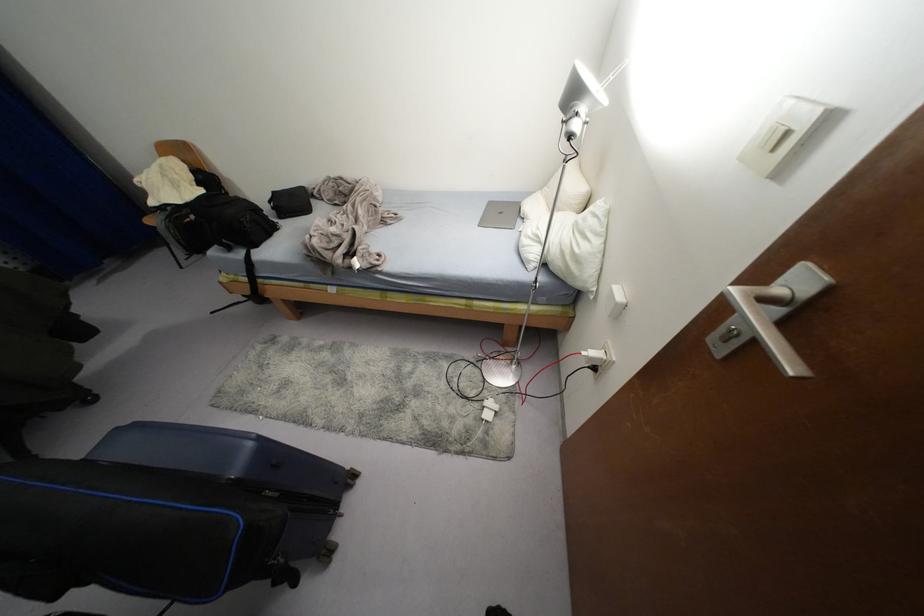
Find where to adjust the adjustable lamp head. Please return your answer as a coordinate pair (x, y).

(584, 90)